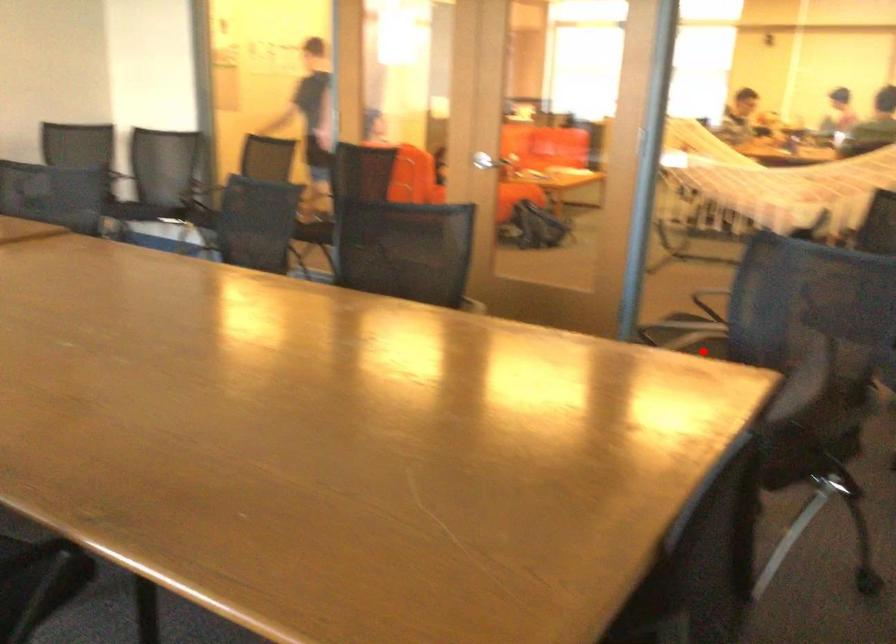
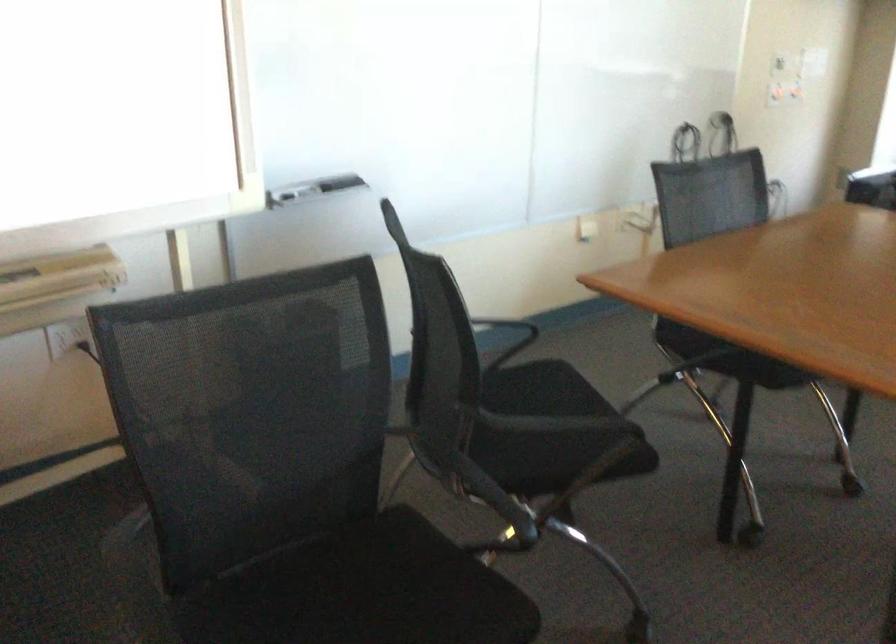
Question: I am providing you with two images of the same scene from different viewpoints. Given a red point in image1, look at the same physical point in image2. Is it:

Choices:
 (A) Closer to the viewpoint
 (B) Farther from the viewpoint

Answer: (A)